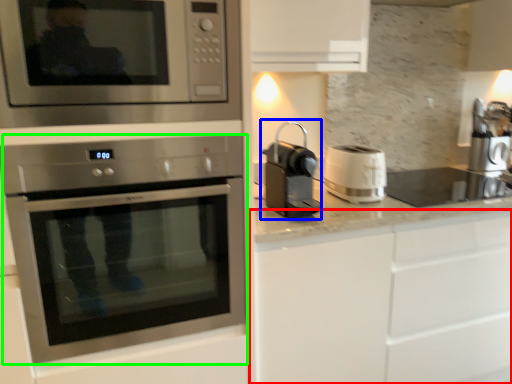
Question: Which is nearer to the cabinetry (highlighted by a red box)? coffee machine (highlighted by a blue box) or oven (highlighted by a green box).

Choices:
 (A) coffee machine
 (B) oven

Answer: (A)